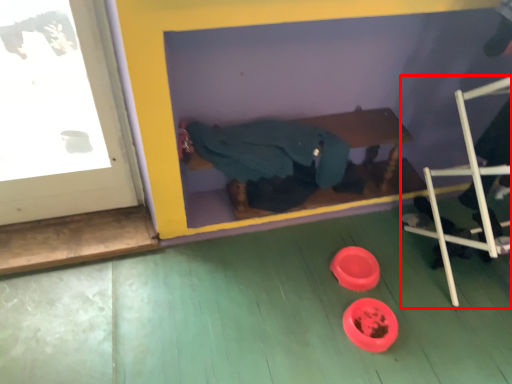
Question: From the image's perspective, what is the correct spatial positioning of furniture (annotated by the red box) in reference to person?

Choices:
 (A) above
 (B) below

Answer: (B)